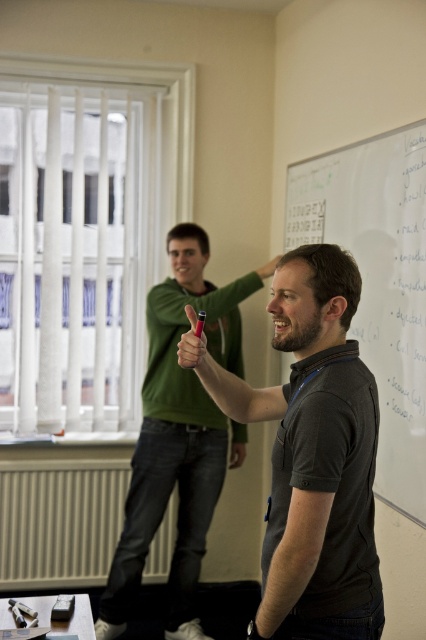
Who is taller, dark gray shirt at center or green matte hoodie at upper left?

With more height is green matte hoodie at upper left.

Who is lower down, dark gray shirt at center or green matte hoodie at upper left?

Result: green matte hoodie at upper left

Does point (371, 570) come behind point (129, 522)?

No, (371, 570) is in front of (129, 522).

Identify the location of dark gray shirt at center. The height and width of the screenshot is (640, 426). (313, 454).

Measure the distance between dark gray shirt at center and camera.

dark gray shirt at center is 1.55 meters from camera.

Who is higher up, dark gray shirt at center or white matte/scratchy whiteboard at upper center?

white matte/scratchy whiteboard at upper center is above.

Is point (342, 563) positioned before point (374, 292)?

That is True.

Locate an element on the screen. dark gray shirt at center is located at coordinates (313, 454).

In the scene shown: Can you confirm if white matte/scratchy whiteboard at upper center is positioned to the left of green matte hoodie at upper left?

In fact, white matte/scratchy whiteboard at upper center is to the right of green matte hoodie at upper left.

Can you confirm if white matte/scratchy whiteboard at upper center is positioned above green matte hoodie at upper left?

Yes.

Which is behind, point (302, 188) or point (203, 452)?

The point (302, 188) is more distant.

Identify the location of white matte/scratchy whiteboard at upper center. This screenshot has width=426, height=640. click(379, 282).